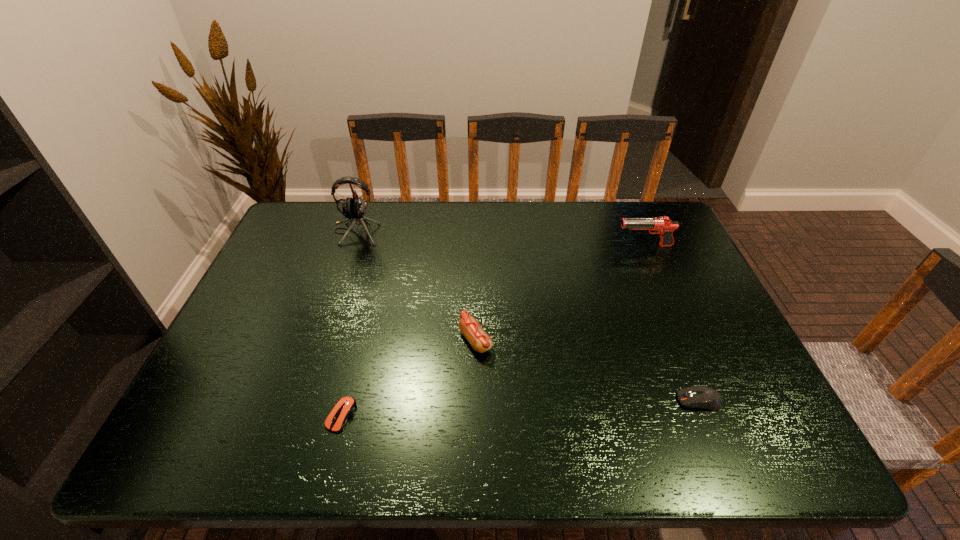
Identify the location of object at the left edge. This screenshot has height=540, width=960. (354, 209).

Image resolution: width=960 pixels, height=540 pixels. I want to click on gun that is at the right edge, so click(x=663, y=226).

Where is `computer equipment present at the right edge`? The width and height of the screenshot is (960, 540). computer equipment present at the right edge is located at coordinates (704, 397).

You are a GUI agent. You are given a task and a screenshot of the screen. Output one action in this format:
    pyautogui.click(x=<x>, y=<y>)
    Task: Click on the object that is at the far left corner
    
    Given the screenshot: What is the action you would take?
    pyautogui.click(x=354, y=209)

This screenshot has height=540, width=960. What are the coordinates of `object that is positioned at the far right corner` in the screenshot? It's located at (663, 226).

In the image, there is a desktop. Identify the location of vacant space at the far edge. The height and width of the screenshot is (540, 960). (332, 244).

Where is `free space at the near edge of the desktop`? free space at the near edge of the desktop is located at coordinates (636, 446).

Where is `free space at the left edge of the desktop`? This screenshot has width=960, height=540. free space at the left edge of the desktop is located at coordinates (245, 364).

At what (x,y) coordinates should I click in order to perform the action: click on vacant space at the right edge of the desktop. Please return your answer as a coordinate pair (x, y). The height and width of the screenshot is (540, 960). Looking at the image, I should click on (681, 361).

At what (x,y) coordinates should I click in order to perform the action: click on vacant region at the near right corner of the desktop. Please return your answer as a coordinate pair (x, y). The image size is (960, 540). Looking at the image, I should click on (777, 437).